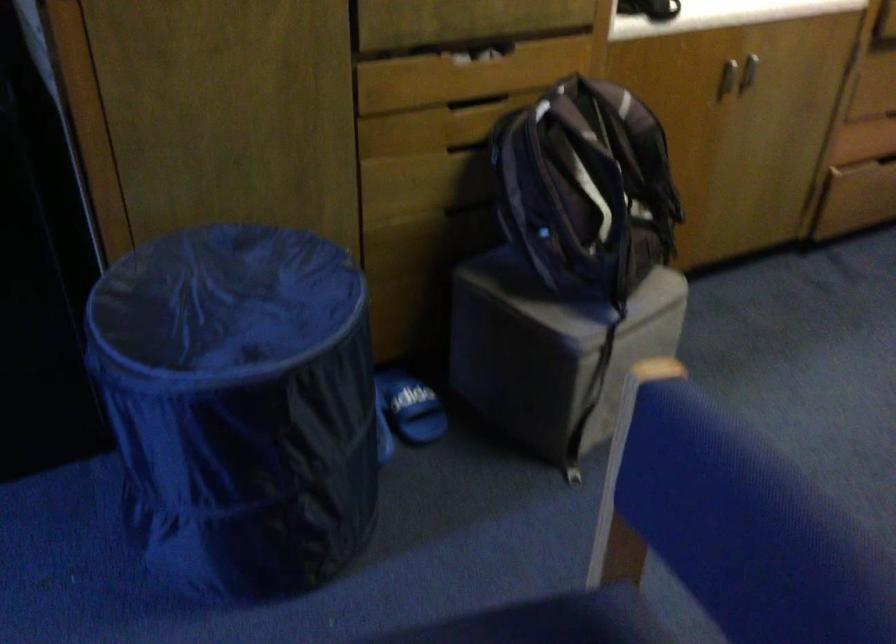
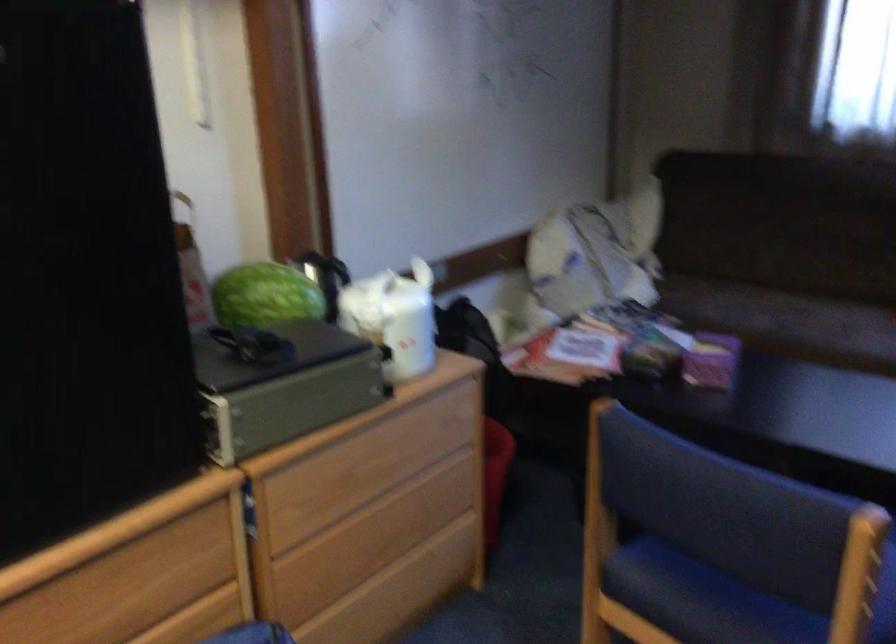
The point at [640,450] is marked in the first image. Where is the corresponding point in the second image?

(858, 574)